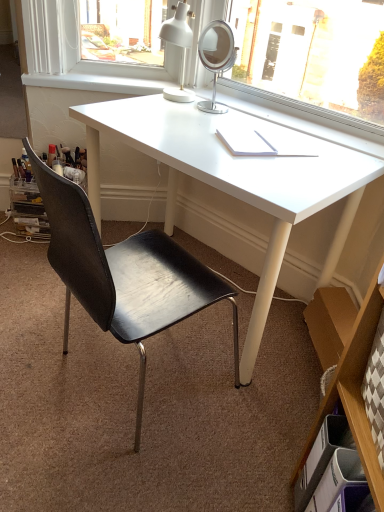
This screenshot has height=512, width=384. Find the location of `free space above white smooth window sill at upper center (from a real-world perspective)`. free space above white smooth window sill at upper center (from a real-world perspective) is located at coordinates (113, 79).